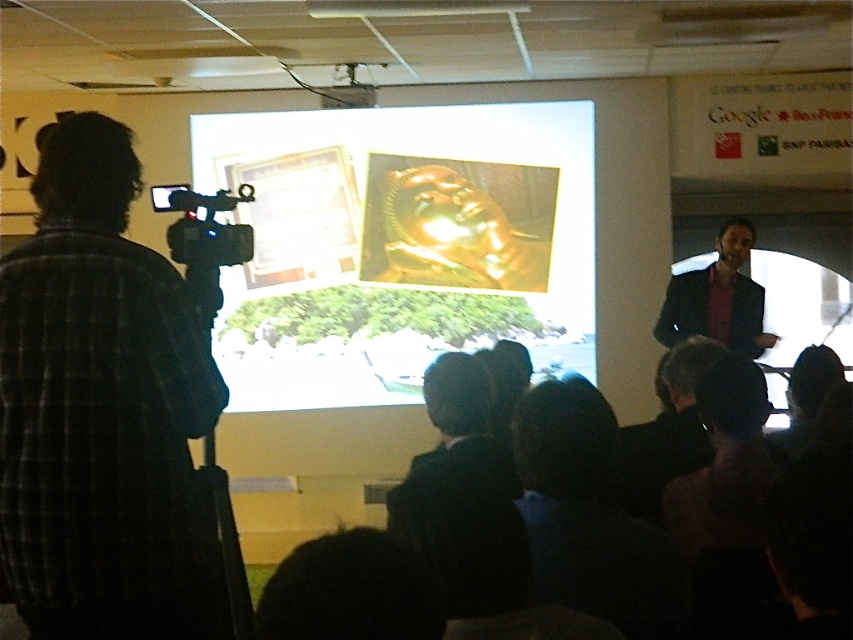
Is point (250, 275) in front of point (73, 124)?

That is False.

Which of these two, metallic gold statue at center or plaid shirt at left, stands shorter?

plaid shirt at left is shorter.

Who is more forward, (x=364, y=362) or (x=22, y=387)?

Positioned in front is point (x=22, y=387).

This screenshot has height=640, width=853. Find the location of `metallic gold statue at center`. metallic gold statue at center is located at coordinates (399, 244).

Who is lower down, plaid shirt at left or black fabric at lower center?

black fabric at lower center is lower down.

Is plaid shirt at left taller than black fabric at lower center?

Correct, plaid shirt at left is much taller as black fabric at lower center.

Who is more distant from viewer, (138, 564) or (728, 381)?

Point (728, 381)

At what (x,y) coordinates should I click in order to perform the action: click on plaid shirt at left. Please return your answer as a coordinate pair (x, y). The image size is (853, 640). Looking at the image, I should click on (103, 410).

The image size is (853, 640). Describe the element at coordinates (399, 244) in the screenshot. I see `metallic gold statue at center` at that location.

Consider the image. Does metallic gold statue at center have a greater height compared to black fabric at lower center?

Yes, metallic gold statue at center is taller than black fabric at lower center.

Is point (241, 392) in front of point (718, 547)?

No, it is behind (718, 547).

The height and width of the screenshot is (640, 853). What are the coordinates of `metallic gold statue at center` in the screenshot? It's located at (399, 244).